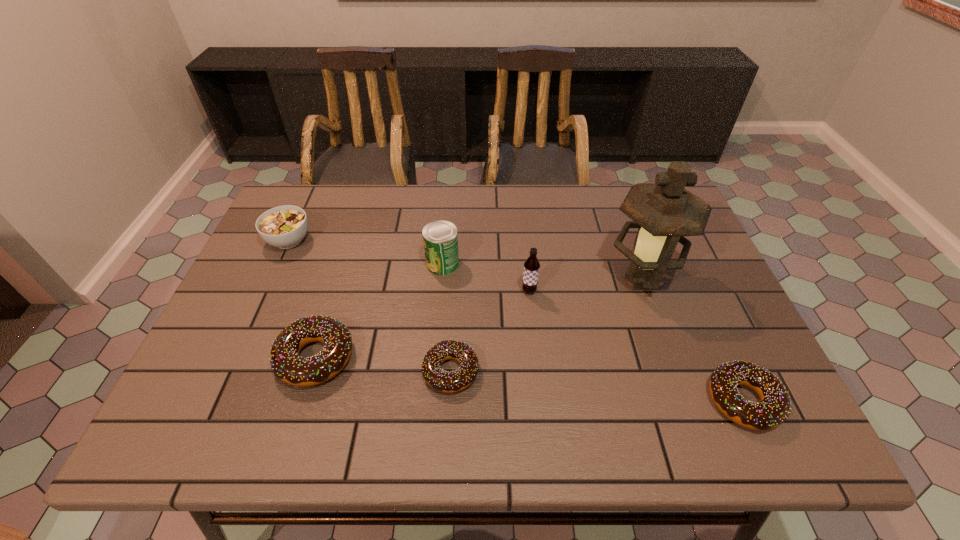
Identify which object is located as the fourth nearest to the second doughnut from right to left. Please provide its 2D coordinates. Your answer should be formatted as a tuple, i.e. [(x, y)], where the tuple contains the x and y coordinates of a point satisfying the conditions above.

[(664, 212)]

Image resolution: width=960 pixels, height=540 pixels. In order to click on doughnut that stands as the third closest to the fifth shortest object in this screenshot , I will do `click(774, 408)`.

Choose which doughnut is the nearest neighbor to the oil lamp. Please provide its 2D coordinates. Your answer should be formatted as a tuple, i.e. [(x, y)], where the tuple contains the x and y coordinates of a point satisfying the conditions above.

[(774, 408)]

Find the location of a particular element. The width and height of the screenshot is (960, 540). blank space that satisfies the following two spatial constraints: 1. on the front side of the third tallest object; 2. on the left side of the sixth tallest object is located at coordinates (431, 401).

This screenshot has height=540, width=960. Find the location of `free space in the image that satisfies the following two spatial constraints: 1. on the front side of the rightmost doughnut; 2. on the left side of the can`. free space in the image that satisfies the following two spatial constraints: 1. on the front side of the rightmost doughnut; 2. on the left side of the can is located at coordinates (431, 401).

I want to click on free space that satisfies the following two spatial constraints: 1. on the front side of the sixth object from right to left; 2. on the left side of the rightmost doughnut, so click(302, 401).